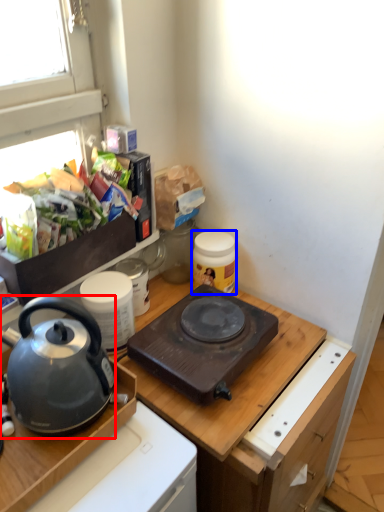
Question: Which of the following is the farthest to the observer, kettle (highlighted by a red box) or kitchen appliance (highlighted by a blue box)?

Choices:
 (A) kettle
 (B) kitchen appliance

Answer: (B)